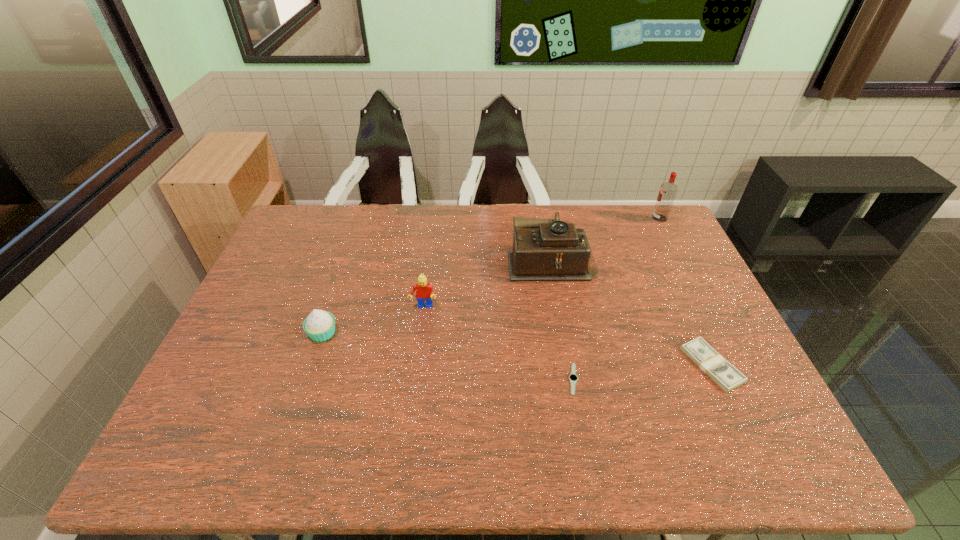
Where is `vacant space located on the front label of the farthest object`? vacant space located on the front label of the farthest object is located at coordinates (547, 218).

Locate an element on the screen. The height and width of the screenshot is (540, 960). vacant space situated 0.250m on the front label of the farthest object is located at coordinates (583, 218).

The image size is (960, 540). Find the location of `free space located 0.220m on the front label of the farthest object`. free space located 0.220m on the front label of the farthest object is located at coordinates (591, 218).

Identify the location of free spot located 0.320m on the horn of the fifth shortest object. Image resolution: width=960 pixels, height=540 pixels. (410, 260).

Find the location of a particular element. free space located 0.320m on the horn of the fifth shortest object is located at coordinates 410,260.

Identify the location of free space located on the horn of the fifth shortest object. (420, 260).

Locate an element on the screen. The height and width of the screenshot is (540, 960). blank area located on the front-facing side of the fifth object from right to left is located at coordinates (420, 328).

You are a GUI agent. You are given a task and a screenshot of the screen. Output one action in this format:
    pyautogui.click(x=<x>, y=<y>)
    Task: Click on the vacant point located on the right of the fourth tallest object
    Image resolution: width=960 pixels, height=540 pixels.
    Given the screenshot: What is the action you would take?
    pyautogui.click(x=425, y=333)

Locate an element on the screen. vacant space located 0.230m on the left of the dollar is located at coordinates (597, 365).

Identify the location of vacant space located 0.160m on the right of the watch. This screenshot has width=960, height=540. (642, 379).